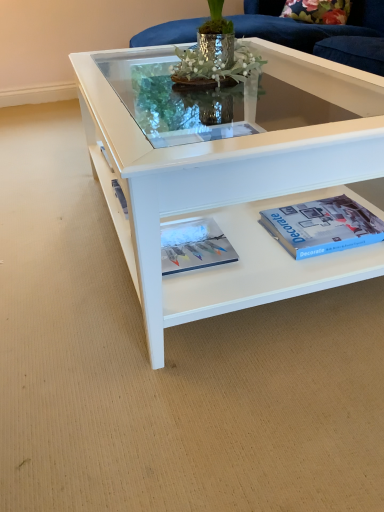
Question: Looking at their shapes, would you say white glossy coffee table at center is wider or thinner than matte white magazine at center?

Choices:
 (A) wide
 (B) thin

Answer: (A)

Question: From the image's perspective, is white glossy coffee table at center above or below matte white magazine at center?

Choices:
 (A) above
 (B) below

Answer: (A)

Question: Which object is the closest to the blue matte paperback book at lower right?

Choices:
 (A) matte white magazine at center
 (B) white glossy coffee table at center

Answer: (B)

Question: Which object is the closest to the white glossy coffee table at center?

Choices:
 (A) matte white magazine at center
 (B) blue matte paperback book at lower right

Answer: (B)